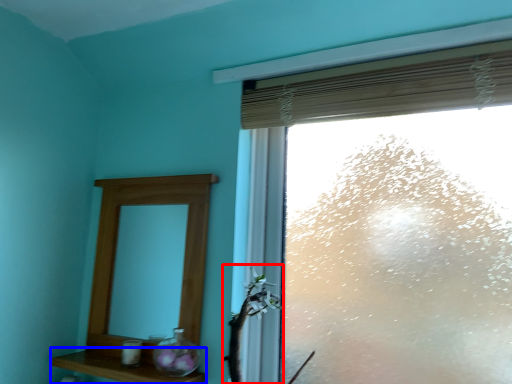
Question: Among these objects, which one is farthest to the camera, plant (highlighted by a red box) or shelf (highlighted by a blue box)?

Choices:
 (A) plant
 (B) shelf

Answer: (B)